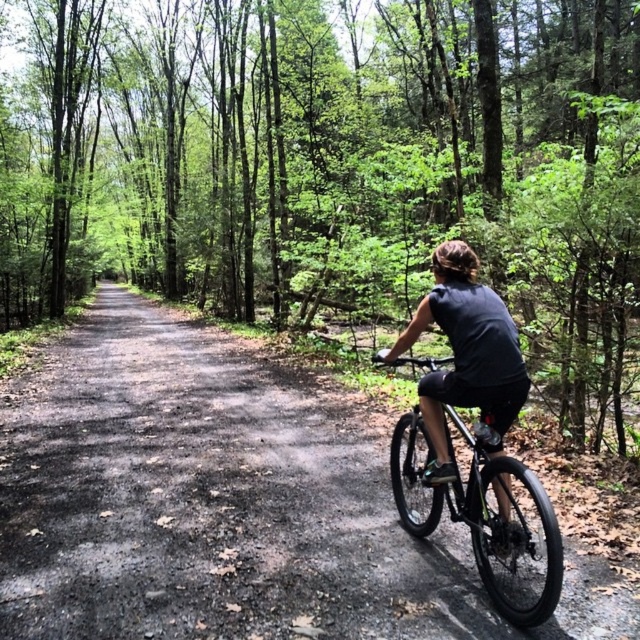
Consider the image. You are a hiker planning to walk along the dirt road at center while avoiding the black matte bicycle at center. Based on the scene, which object takes up more space in the image?

The black matte bicycle at center occupies more space in the image than the dirt road at center.

You are navigating a mountain bike along the forest trail shown in the image. You notice two points marked on the trail. The first point is at coordinates point (268, 461) and the second is at point (488, 346). If you are currently at the first point, which direction should you head to reach the second point?

Since point (268, 461) is behind point (488, 346), you should head forward along the trail to reach the second point.